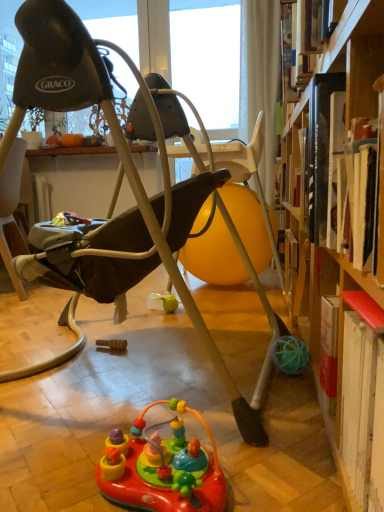
Locate an element on the screen. unoccupied space behind multicolored plastic toy at center is located at coordinates (155, 402).